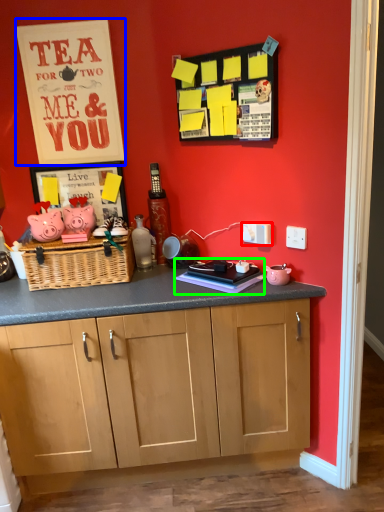
Question: Based on their relative distances, which object is nearer to electric outlet (highlighted by a red box)? Choose from postcard (highlighted by a blue box) and book (highlighted by a green box).

Choices:
 (A) postcard
 (B) book

Answer: (B)